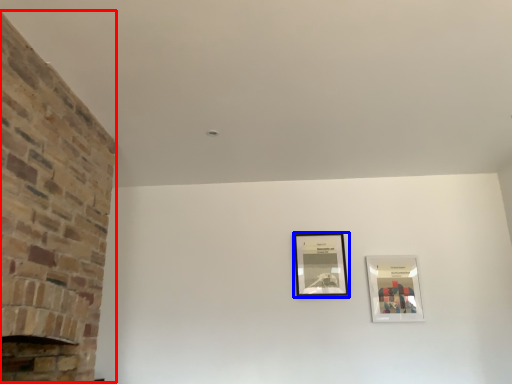
Question: Among these objects, which one is nearest to the camera, fireplace (highlighted by a red box) or picture frame (highlighted by a blue box)?

Choices:
 (A) fireplace
 (B) picture frame

Answer: (A)